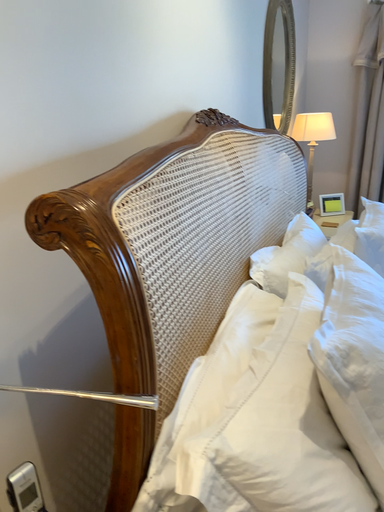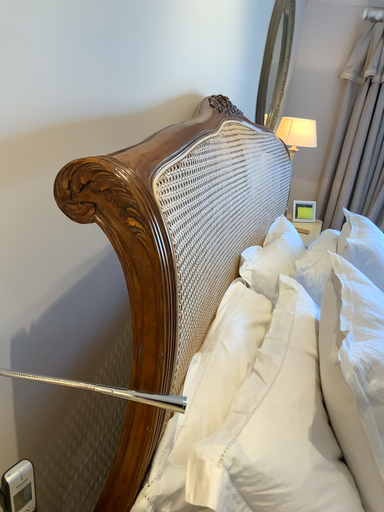
Question: How did the camera likely rotate when shooting the video?

Choices:
 (A) rotated right
 (B) rotated left

Answer: (A)